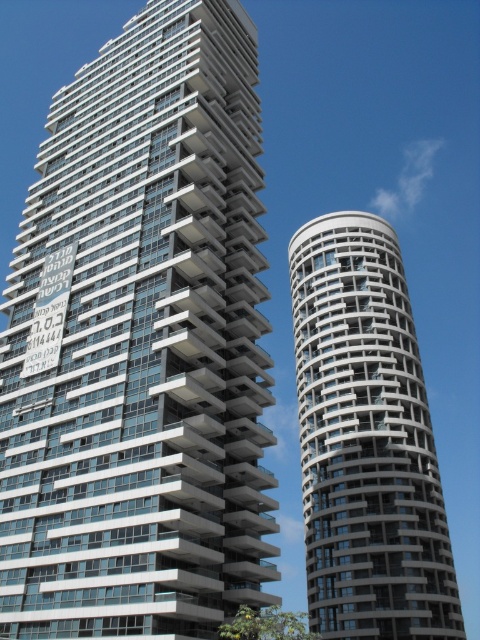
You are a city planner assessing the skyline. You need to determine which building, the matte glass building at center or the white textured building at right, is taller. Based on the scene, which one is taller?

The matte glass building at center is taller than the white textured building at right according to the description.

You are a drone operator tasked with delivering a package to the matte glass building at center. The delivery zone is at point coordinates of (141,344). Are you able to land the drone at this point?

Yes, the matte glass building at center is located exactly at point coordinates of (141,344), so the drone can land there.